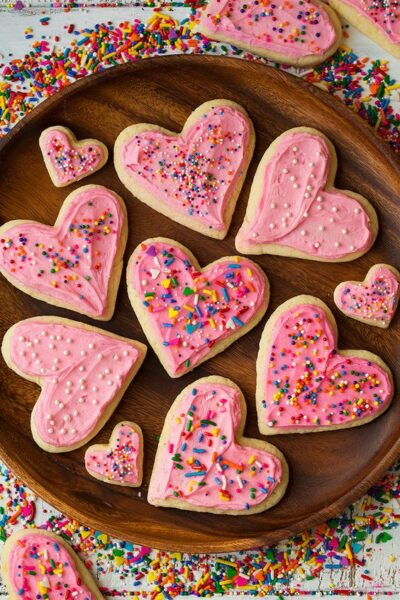
The height and width of the screenshot is (600, 400). I want to click on platter, so click(x=151, y=84).